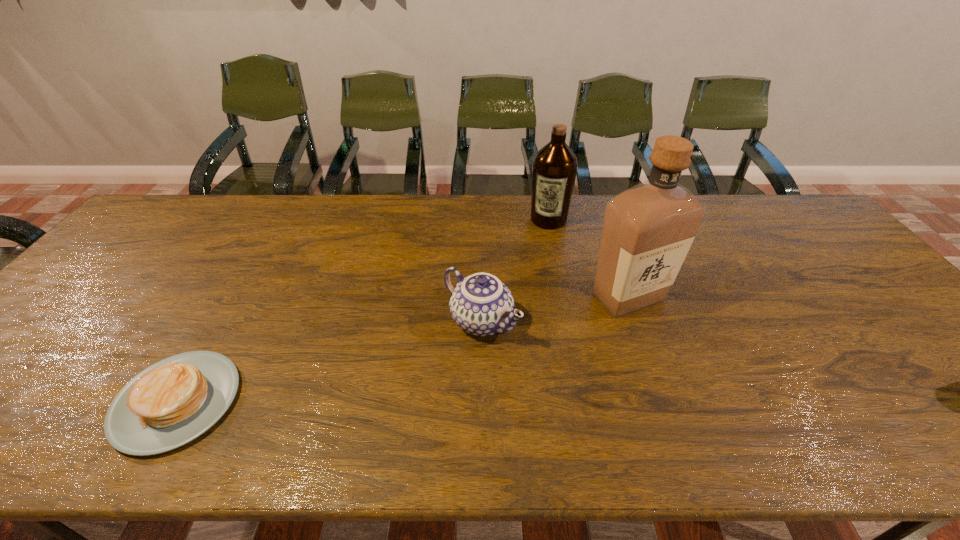
What are the coordinates of `free spot located on the front-facing side of the tallest object` in the screenshot? It's located at (637, 370).

In order to click on vacant space situated from the spout of the third tallest object in this screenshot , I will do `click(561, 381)`.

Locate an element on the screen. This screenshot has width=960, height=540. free space located 0.240m from the spout of the third tallest object is located at coordinates (590, 403).

The height and width of the screenshot is (540, 960). In order to click on free spot located from the spout of the third tallest object in this screenshot , I will do `click(530, 358)`.

The image size is (960, 540). Identify the location of vacant area located on the label of the second tallest object. (526, 288).

I want to click on free space located on the label of the second tallest object, so click(539, 249).

At what (x,y) coordinates should I click in order to perform the action: click on vacant space located on the label of the second tallest object. Please return your answer as a coordinate pair (x, y). Looking at the image, I should click on (535, 264).

In order to click on object that is at the far edge in this screenshot , I will do `click(554, 169)`.

Where is `object present at the near edge`? object present at the near edge is located at coordinates [174, 401].

This screenshot has height=540, width=960. In order to click on vacant area at the far edge in this screenshot , I will do `click(757, 233)`.